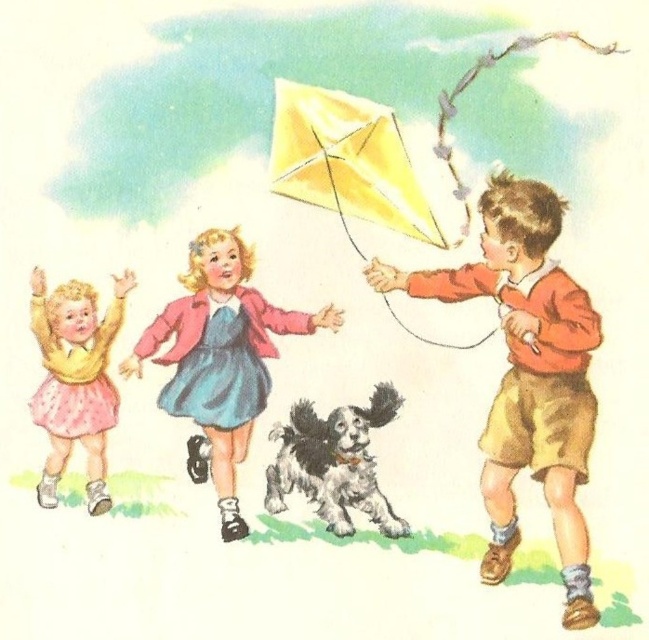
Is yellow paper kite at upper center bigger than fluffy white dog at center?

Yes.

Does yellow paper kite at upper center appear under fluffy white dog at center?

Incorrect, yellow paper kite at upper center is not positioned below fluffy white dog at center.

Identify the location of yellow paper kite at upper center. (347, 160).

Between point (495, 234) and point (334, 483), which one is positioned in front?

Point (495, 234)

What do you see at coordinates (528, 374) in the screenshot? The height and width of the screenshot is (640, 649). I see `matte orange sweater at right` at bounding box center [528, 374].

At what (x,y) coordinates should I click in order to perform the action: click on matte orange sweater at right. Please return your answer as a coordinate pair (x, y). Looking at the image, I should click on (528, 374).

Can you confirm if matte pink dress at center is positioned below yellow paper kite at upper center?

Indeed, matte pink dress at center is positioned under yellow paper kite at upper center.

Which is behind, point (206, 230) or point (422, 205)?

The point (206, 230) is more distant.

Identify the location of matte pink dress at center. This screenshot has height=640, width=649. (221, 355).